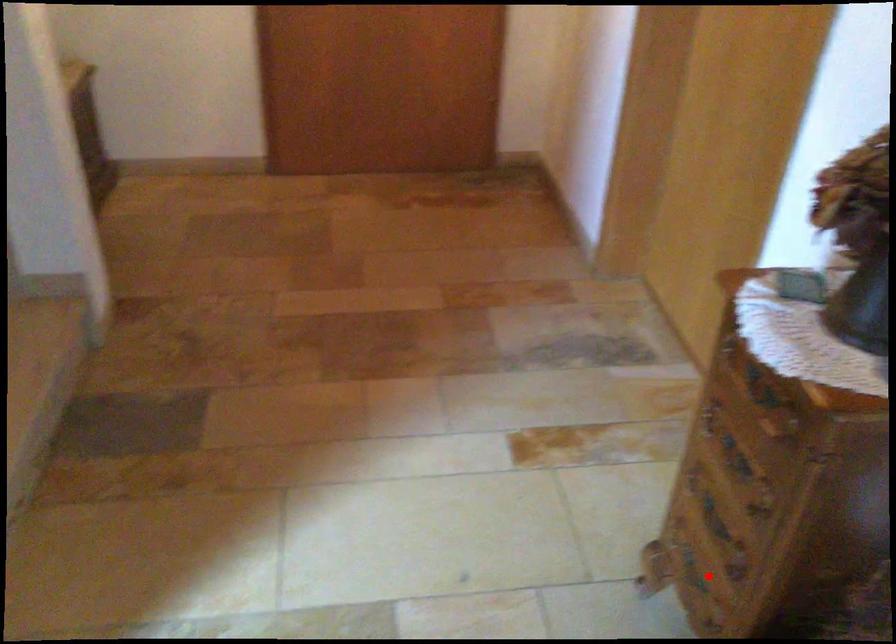
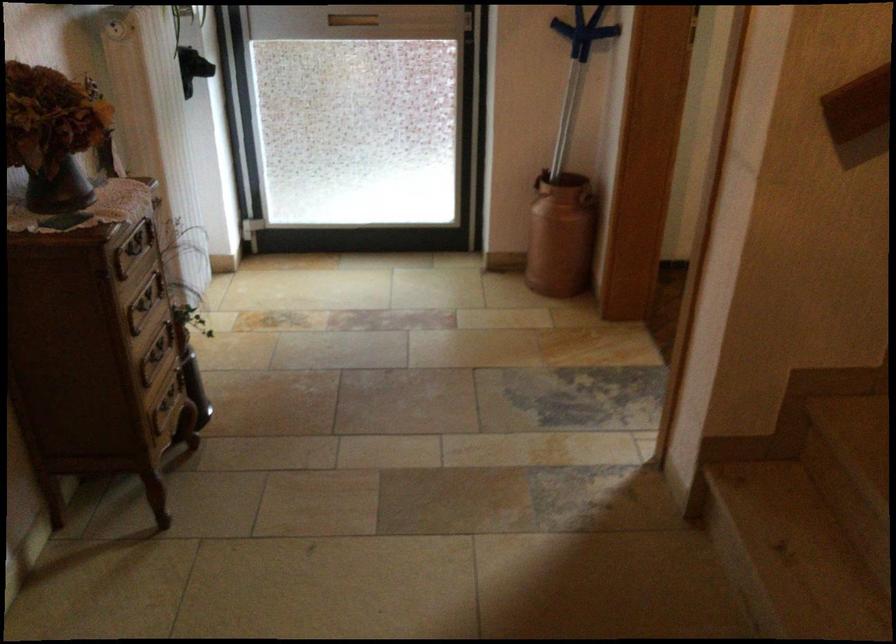
Question: A red point is marked in image1. In image2, is the corresponding 3D point closer to the camera or farther? Reply with the corresponding letter.

Choices:
 (A) The corresponding 3D point is closer.
 (B) The corresponding 3D point is farther.

Answer: (B)